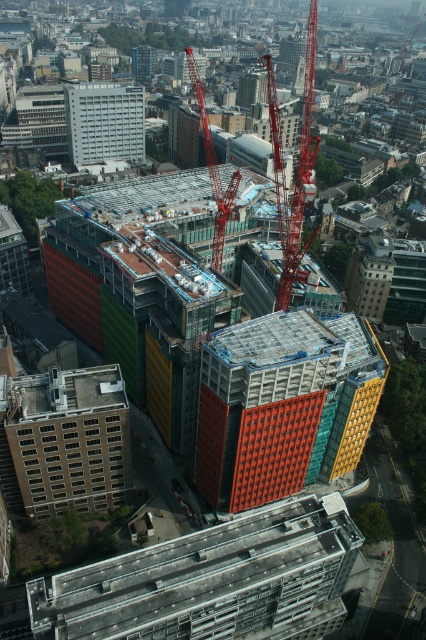
Between brown concrete building at lower left and metallic red crane at center, which one appears on the right side from the viewer's perspective?

From the viewer's perspective, metallic red crane at center appears more on the right side.

Between point (106, 392) and point (313, 45), which one is positioned in front?

Point (106, 392)

What are the coordinates of `brown concrete building at lower left` in the screenshot? It's located at (69, 440).

Can you confirm if orange textured building at center is shorter than white concrete building at center?

Incorrect, orange textured building at center's height does not fall short of white concrete building at center's.

Is point (210, 490) closer to camera compared to point (83, 99)?

Yes, it is in front of point (83, 99).

You are a GUI agent. You are given a task and a screenshot of the screen. Output one action in this format:
    pyautogui.click(x=<x>, y=<y>)
    Task: Click on the orange textured building at center
    The image size is (426, 640).
    Given the screenshot: What is the action you would take?
    pyautogui.click(x=284, y=404)

Looking at this image, is orange textured building at center below red metallic crane at center?

Yes, orange textured building at center is below red metallic crane at center.

Between orange textured building at center and red metallic crane at center, which one has more height?

With more height is red metallic crane at center.

Find the location of a particular element. The height and width of the screenshot is (640, 426). orange textured building at center is located at coordinates (284, 404).

Locate an element on the screen. The image size is (426, 640). orange textured building at center is located at coordinates (284, 404).